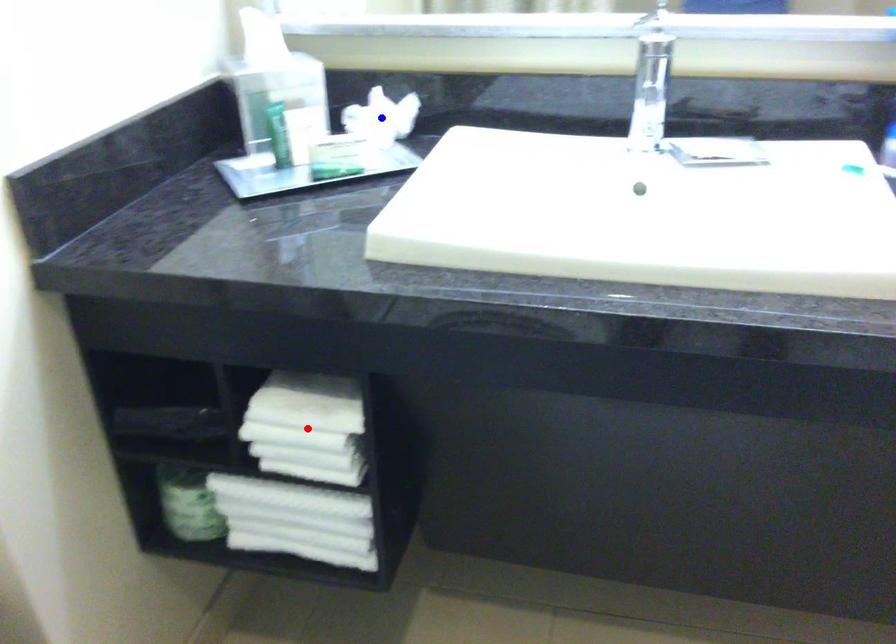
Question: In the image, two points are highlighted. Which point is nearer to the camera? Reply with the corresponding letter.

Choices:
 (A) blue point
 (B) red point

Answer: (B)